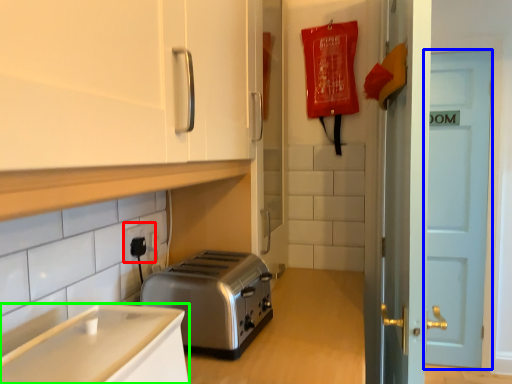
Question: Based on their relative distances, which object is nearer to electric outlet (highlighted by a red box)? Choose from door (highlighted by a blue box) and cabinetry (highlighted by a green box).

Choices:
 (A) door
 (B) cabinetry

Answer: (B)